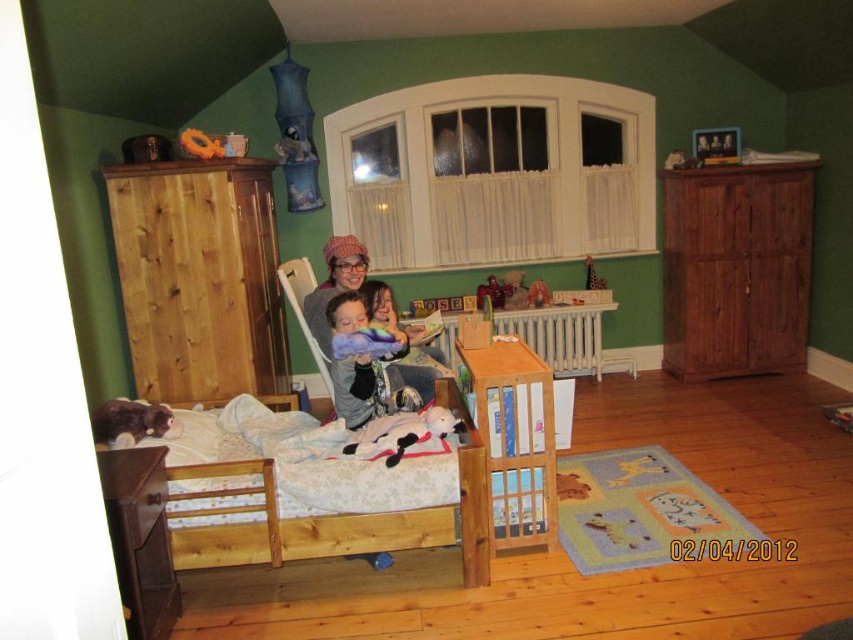
Question: Does matte plastic toy at center appear under wooden toy at center?

Choices:
 (A) yes
 (B) no

Answer: (A)

Question: Can you confirm if soft plush toy at center is positioned to the left of matte plastic chair at center?

Choices:
 (A) yes
 (B) no

Answer: (B)

Question: Which is farther from the wooden giraffe at center?

Choices:
 (A) soft plush toy at center
 (B) matte plastic chair at center

Answer: (A)

Question: Considering the real-world distances, which object is closest to the wooden giraffe at center?

Choices:
 (A) soft plush toy at center
 (B) rubber ring at center
 (C) wooden toy at center
 (D) soft purple plush toy at center

Answer: (C)

Question: Estimate the real-world distances between objects in this image. Which object is closer to the fuzzy brown stuffed animal at lower left?

Choices:
 (A) rubber ring at center
 (B) matte plastic toy at center
 (C) matte purple blanket at center
 (D) wooden bed at center

Answer: (D)

Question: From the image, what is the correct spatial relationship of fuzzy brown stuffed animal at lower left in relation to matte plastic chair at center?

Choices:
 (A) above
 (B) below

Answer: (B)